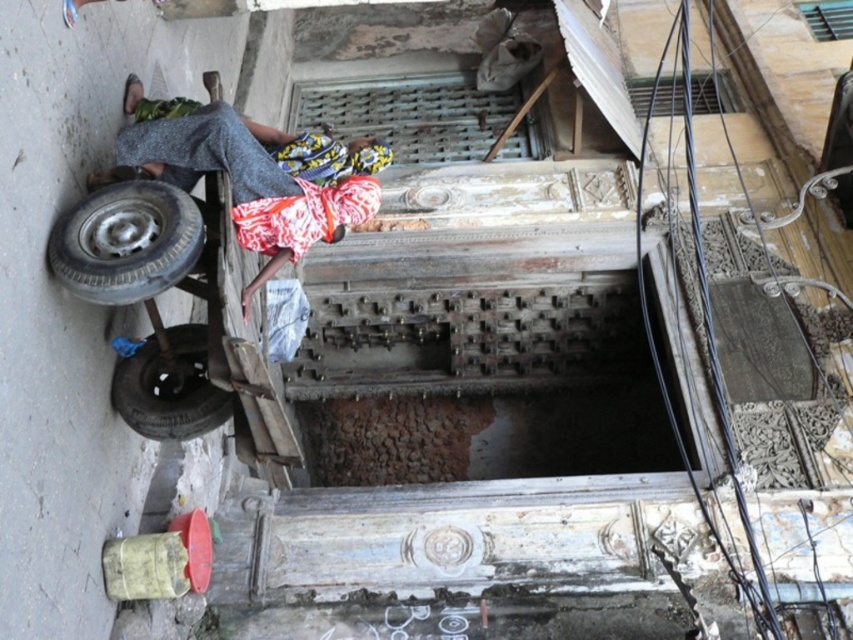
Question: Can you confirm if printed fabric headscarf at upper center is positioned to the right of black rubber tire at lower left?

Choices:
 (A) no
 (B) yes

Answer: (B)

Question: Which point is farther to the camera?

Choices:
 (A) rubber/smooth tire at lower left
 (B) printed fabric headscarf at upper center
 (C) black rubber tire at lower left

Answer: (C)

Question: Does printed fabric headscarf at upper center come behind black rubber tire at lower left?

Choices:
 (A) no
 (B) yes

Answer: (A)

Question: Which of the following is the closest to the observer?

Choices:
 (A) black rubber tire at lower left
 (B) rubber/smooth tire at lower left

Answer: (B)

Question: Does rubber/smooth tire at lower left have a smaller size compared to black rubber tire at lower left?

Choices:
 (A) no
 (B) yes

Answer: (B)

Question: Among these points, which one is farthest from the camera?

Choices:
 (A) (230, 400)
 (B) (252, 234)

Answer: (A)